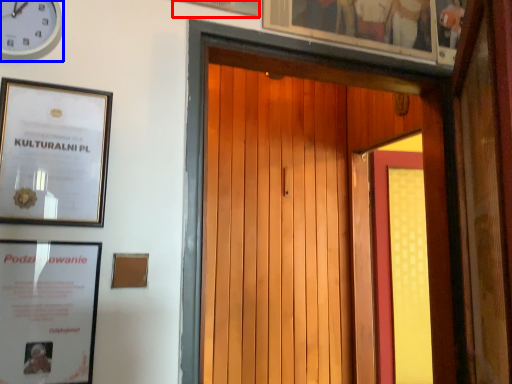
Question: Which object appears farthest to the camera in this image, picture frame (highlighted by a red box) or clock (highlighted by a blue box)?

Choices:
 (A) picture frame
 (B) clock

Answer: (A)